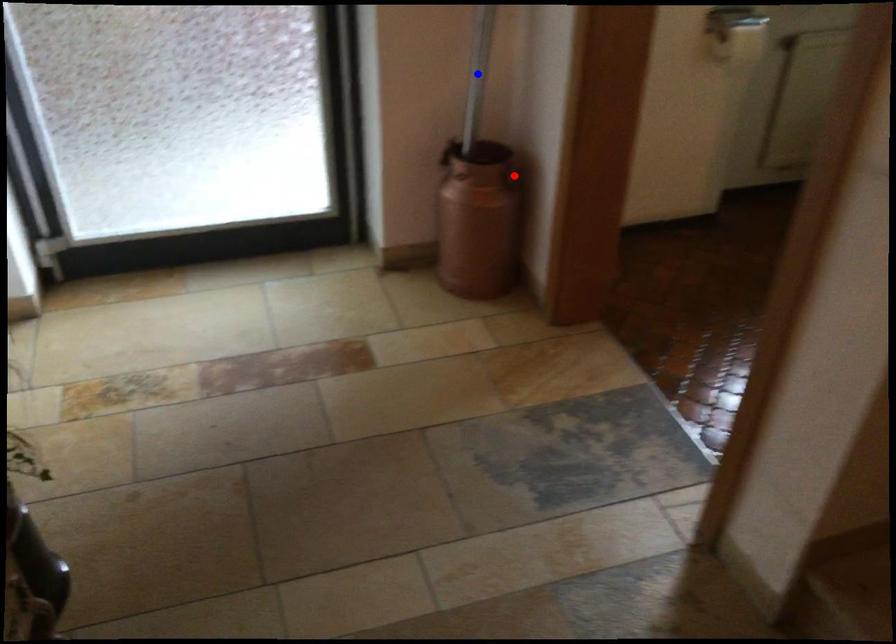
Question: In the image, two points are highlighted. Which point is nearer to the camera? Reply with the corresponding letter.

Choices:
 (A) blue point
 (B) red point

Answer: (A)